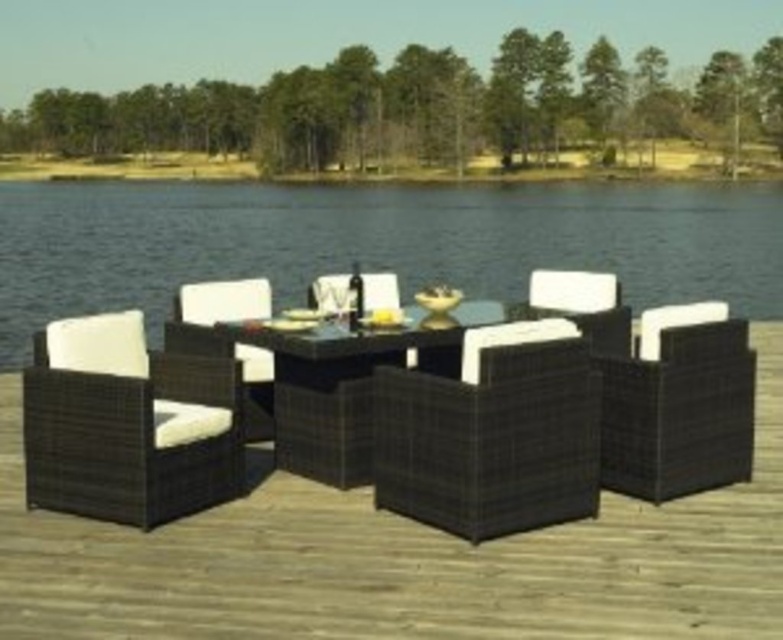
You are standing at the edge of the dock and want to sit down in the black wicker armchair at center. Which direction should you walk to reach it?

You should walk towards the center of the dock to reach the black wicker armchair at center, as it is located at point (493,433).